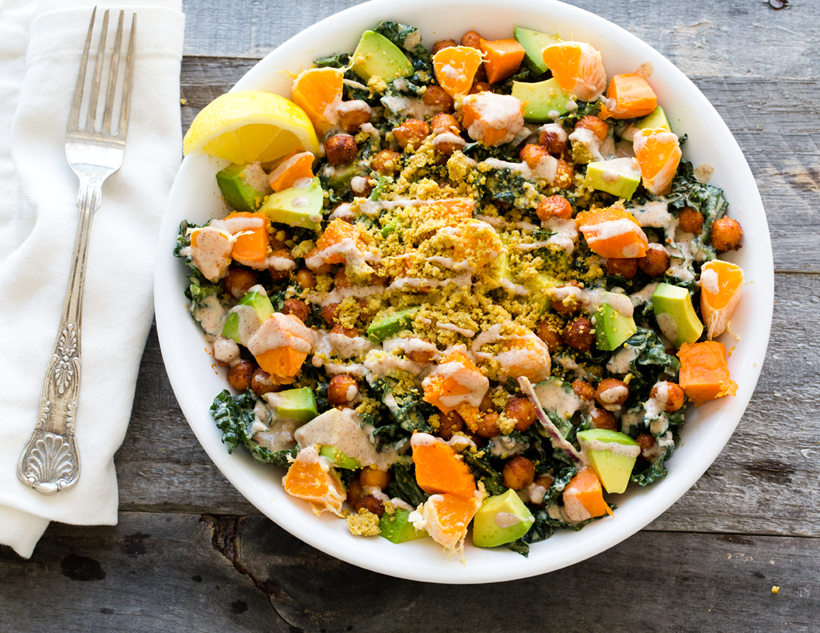
Find the location of a particular element. This screenshot has height=633, width=820. fork is located at coordinates (84, 220).